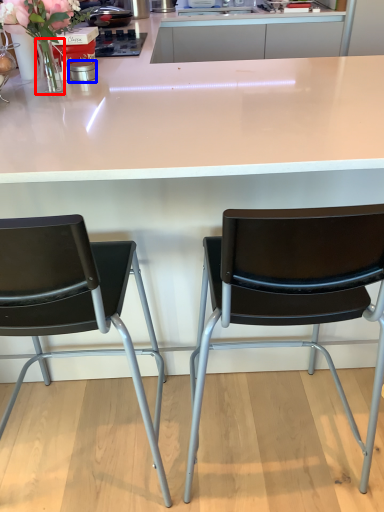
Question: Which of the following is the closest to the observer, vase (highlighted by a red box) or appliance (highlighted by a blue box)?

Choices:
 (A) vase
 (B) appliance

Answer: (A)